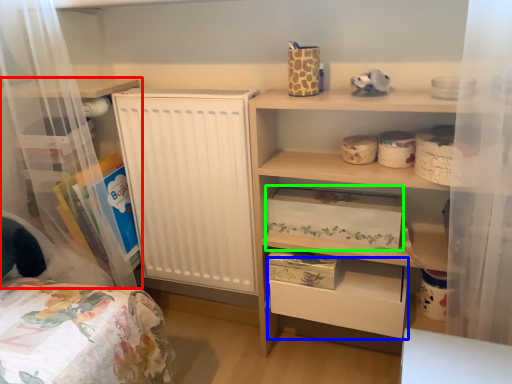
Question: Which object is positioned farthest from shelf (highlighted by a red box)? Select from drawer (highlighted by a blue box) and storage box (highlighted by a green box).

Choices:
 (A) drawer
 (B) storage box

Answer: (A)